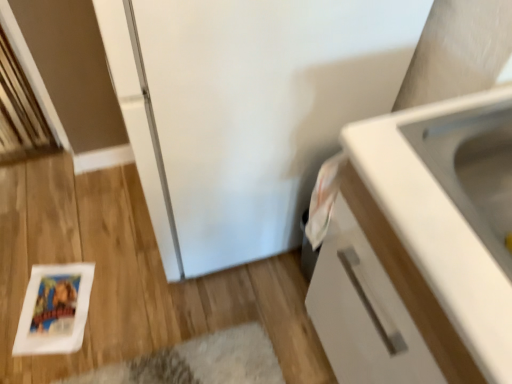
Question: Does white matte cabinet at right have a larger size compared to white glossy sink at upper right?

Choices:
 (A) no
 (B) yes

Answer: (B)

Question: Can you confirm if white matte cabinet at right is taller than white glossy sink at upper right?

Choices:
 (A) no
 (B) yes

Answer: (B)

Question: Is white matte cabinet at right further to the viewer compared to white glossy sink at upper right?

Choices:
 (A) yes
 (B) no

Answer: (B)

Question: Considering the relative positions of white matte cabinet at right and white glossy sink at upper right in the image provided, is white matte cabinet at right to the right of white glossy sink at upper right from the viewer's perspective?

Choices:
 (A) no
 (B) yes

Answer: (B)

Question: From the image's perspective, is white matte cabinet at right located above white glossy sink at upper right?

Choices:
 (A) no
 (B) yes

Answer: (A)

Question: Is white matte cabinet at right to the left of white glossy sink at upper right from the viewer's perspective?

Choices:
 (A) yes
 (B) no

Answer: (B)

Question: Does white glossy sink at upper right lie behind white matte cabinet at right?

Choices:
 (A) no
 (B) yes

Answer: (B)

Question: Could you tell me if white glossy sink at upper right is turned towards white matte cabinet at right?

Choices:
 (A) no
 (B) yes

Answer: (B)

Question: Is white glossy sink at upper right outside white matte cabinet at right?

Choices:
 (A) yes
 (B) no

Answer: (B)

Question: Does white glossy sink at upper right have a lesser width compared to white matte cabinet at right?

Choices:
 (A) yes
 (B) no

Answer: (A)

Question: Considering the relative sizes of white glossy sink at upper right and white matte cabinet at right in the image provided, is white glossy sink at upper right shorter than white matte cabinet at right?

Choices:
 (A) no
 (B) yes

Answer: (B)

Question: From the image's perspective, does white glossy sink at upper right appear lower than white matte cabinet at right?

Choices:
 (A) no
 (B) yes

Answer: (A)

Question: From a real-world perspective, is white matte cabinet at right above or below white glossy sink at upper right?

Choices:
 (A) above
 (B) below

Answer: (B)